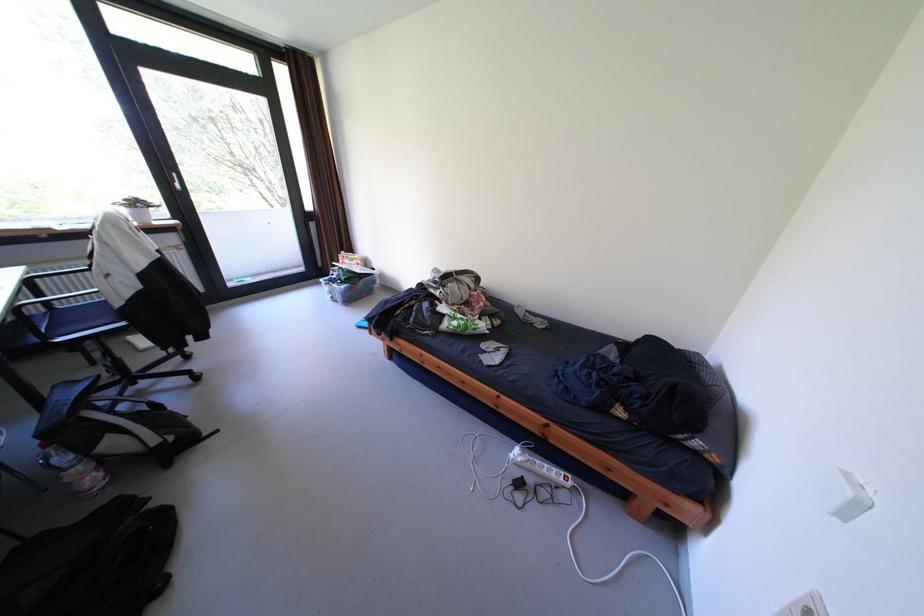
The height and width of the screenshot is (616, 924). I want to click on chair sitting surface, so click(x=73, y=318).